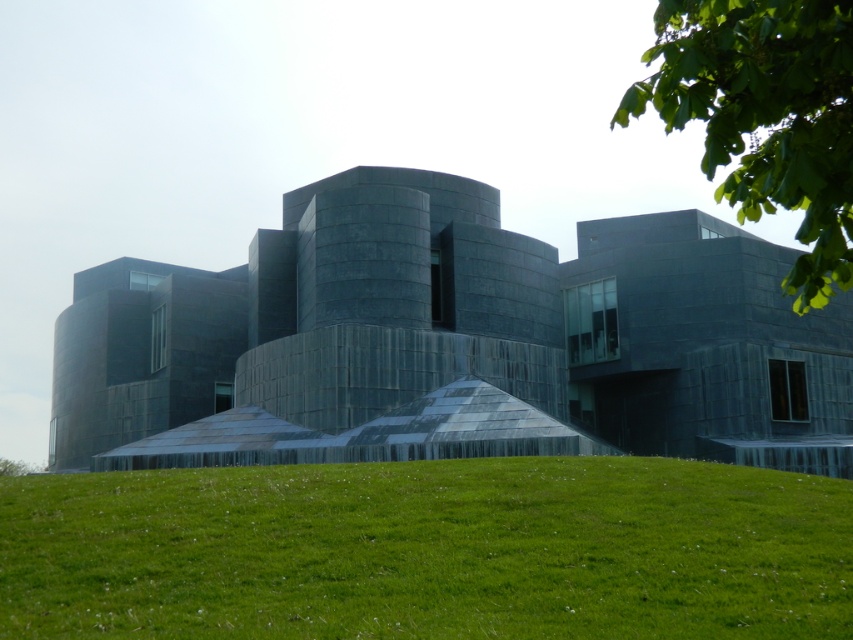
Is dark gray stone building at center to the left of green grass at lower center from the viewer's perspective?

Indeed, dark gray stone building at center is positioned on the left side of green grass at lower center.

Is dark gray stone building at center in front of green grass at lower center?

No, it is behind green grass at lower center.

Who is more distant from viewer, (94, 444) or (409, 609)?

Positioned behind is point (94, 444).

This screenshot has height=640, width=853. Identify the location of dark gray stone building at center. (451, 342).

Measure the distance between point (730, 605) and camera.

A distance of 28.05 feet exists between point (730, 605) and camera.

Locate an element on the screen. This screenshot has width=853, height=640. green grass at lower center is located at coordinates coord(428,552).

What do you see at coordinates (451, 342) in the screenshot? I see `dark gray stone building at center` at bounding box center [451, 342].

Which of these two, dark gray stone building at center or green leafy tree at upper right, stands taller?

Standing taller between the two is green leafy tree at upper right.

Is point (312, 195) closer to viewer compared to point (773, 10)?

No, it is not.

Identify the location of dark gray stone building at center. This screenshot has height=640, width=853. (451, 342).